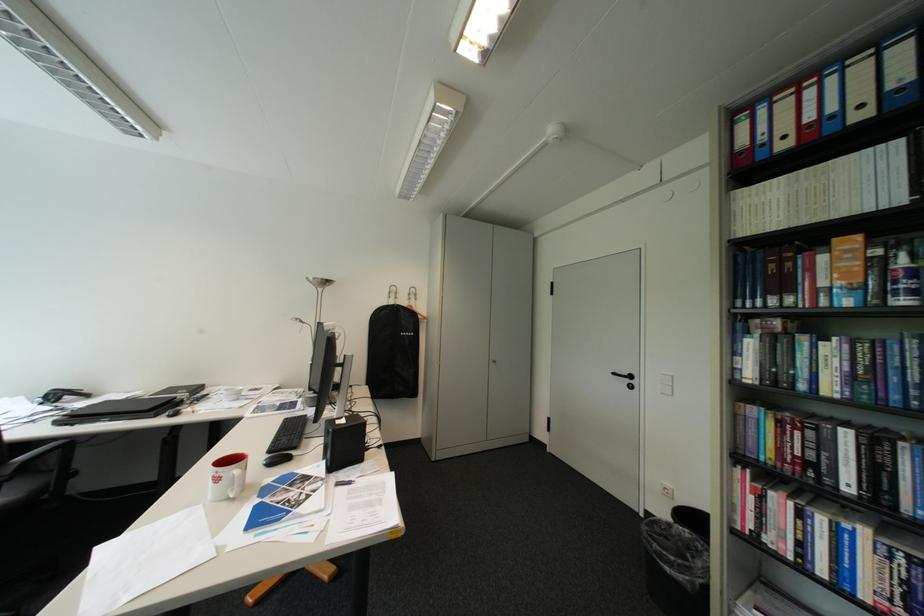
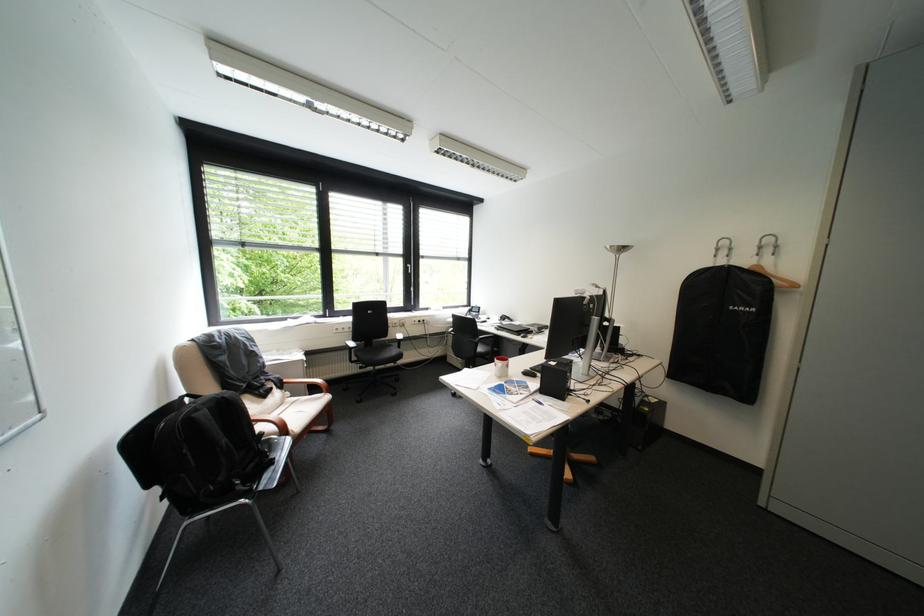
The point at (419, 334) is marked in the first image. Where is the corresponding point in the second image?

(755, 309)